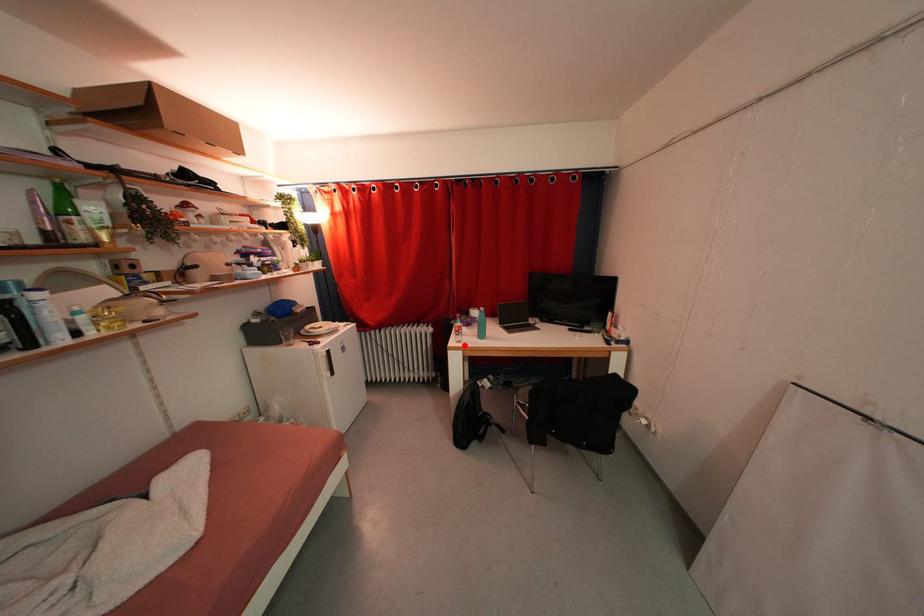
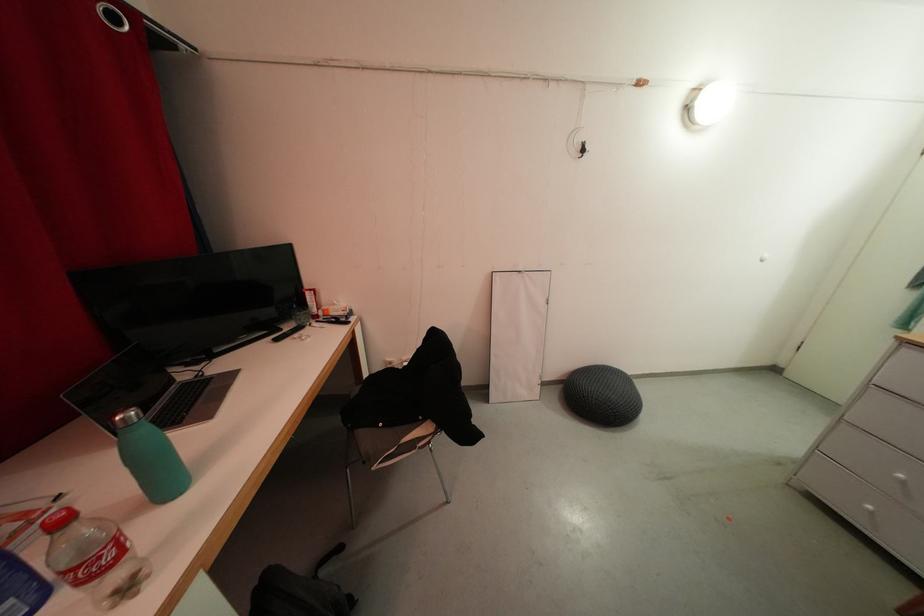
Locate, in the second image, the point that corresponds to the highlighted location in the first image.

(134, 593)